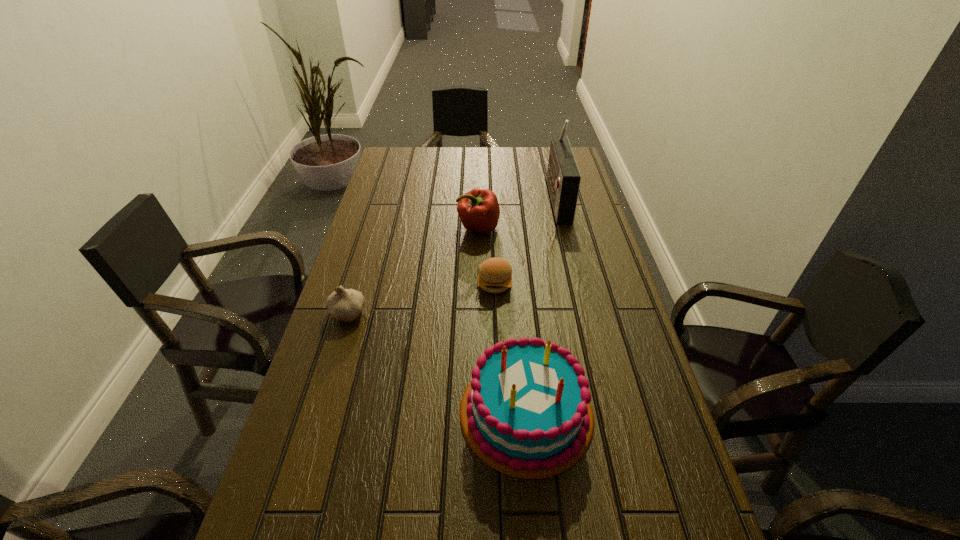
Locate an element on the screen. The image size is (960, 540). the rightmost object is located at coordinates click(x=563, y=177).

The height and width of the screenshot is (540, 960). In order to click on the tallest object in this screenshot , I will do `click(563, 177)`.

In order to click on the fourth shortest object in this screenshot , I will do `click(526, 413)`.

Locate an element on the screen. The height and width of the screenshot is (540, 960). birthday cake is located at coordinates (x=526, y=413).

Where is `bell pepper`? This screenshot has height=540, width=960. bell pepper is located at coordinates (478, 209).

The image size is (960, 540). Identify the location of the second nearest object. (344, 305).

The width and height of the screenshot is (960, 540). I want to click on garlic, so click(x=344, y=305).

The image size is (960, 540). Identify the location of hamburger. (495, 274).

This screenshot has height=540, width=960. I want to click on the shortest object, so click(495, 274).

The width and height of the screenshot is (960, 540). I want to click on vacant space located on the front panel of the rightmost object, so click(508, 198).